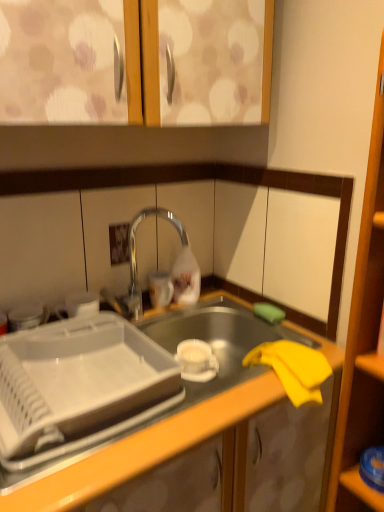
This screenshot has height=512, width=384. Describe the element at coordinates (362, 489) in the screenshot. I see `transparent plastic shelf at lower right` at that location.

This screenshot has height=512, width=384. Find the location of `white plastic tray at center`. white plastic tray at center is located at coordinates (78, 386).

Can you tell me how much polished chrome tap at center and transparent plastic shelf at lower right differ in facing direction?

They differ by 92.6 degrees in their facing directions.

From a real-world perspective, is polished chrome tap at center physically below transparent plastic shelf at lower right?

No, from a real-world perspective, polished chrome tap at center is not under transparent plastic shelf at lower right.

Between point (175, 216) and point (351, 470), which one is positioned behind?

The point (175, 216) is more distant.

Which of these two, polished chrome tap at center or transparent plastic shelf at lower right, stands taller?

Standing taller between the two is polished chrome tap at center.

Choose the correct answer: Is white plastic tray at center inside polished chrome tap at center or outside it?

white plastic tray at center lies outside polished chrome tap at center.

Is white plastic tray at center taller or shorter than polished chrome tap at center?

Considering their sizes, white plastic tray at center has less height than polished chrome tap at center.

Is point (102, 379) farther from viewer compared to point (180, 239)?

No, it is not.

Which object is positioned more to the left, white plastic tray at center or polished chrome tap at center?

From the viewer's perspective, white plastic tray at center appears more on the left side.

Which is nearer, (135, 230) or (0, 501)?

Point (135, 230) appears to be farther away from the viewer than point (0, 501).

Is polished chrome tap at center to the left or to the right of yellow fabric at lower right in the image?

polished chrome tap at center is positioned on yellow fabric at lower right's left side.

From a real-world perspective, is polished chrome tap at center positioned above or below yellow fabric at lower right?

polished chrome tap at center is above yellow fabric at lower right.

Locate an element on the screen. The width and height of the screenshot is (384, 512). shelf that appears behind the matte wood cabinet doors at upper center is located at coordinates (362, 489).

Between matte wood cabinet doors at upper center and transparent plastic shelf at lower right, which one appears on the right side from the viewer's perspective?

transparent plastic shelf at lower right is more to the right.

Considering the relative sizes of matte wood cabinet doors at upper center and transparent plastic shelf at lower right in the image provided, is matte wood cabinet doors at upper center bigger than transparent plastic shelf at lower right?

Indeed, matte wood cabinet doors at upper center has a larger size compared to transparent plastic shelf at lower right.

Does matte wood cabinet doors at upper center contain transparent plastic shelf at lower right?

No, matte wood cabinet doors at upper center does not contain transparent plastic shelf at lower right.

In the scene shown: Is there a large distance between polished chrome tap at center and white plastic tray at center?

polished chrome tap at center is near white plastic tray at center, not far away.

From a real-world perspective, relative to white plastic tray at center, is polished chrome tap at center vertically above or below?

polished chrome tap at center is situated higher than white plastic tray at center in the real world.

Looking at the image, does polished chrome tap at center seem bigger or smaller compared to white plastic tray at center?

Clearly, polished chrome tap at center is smaller in size than white plastic tray at center.

Where is `appliance below the polished chrome tap at center (from the image's perspective)`? This screenshot has width=384, height=512. appliance below the polished chrome tap at center (from the image's perspective) is located at coordinates (78, 386).

What are the coordinates of `countertop in front of the white plastic tray at center` in the screenshot? It's located at (145, 448).

Considering the relative sizes of white plastic tray at center and yellow fabric at lower right in the image provided, is white plastic tray at center bigger than yellow fabric at lower right?

No.

Is white plastic tray at center looking in the opposite direction of yellow fabric at lower right?

No, white plastic tray at center is not facing the opposite direction of yellow fabric at lower right.

Is point (18, 459) closer to camera compared to point (81, 474)?

No, (18, 459) is further to viewer.

Is matte wood cabinet doors at upper center in front of or behind white plastic tray at center in the image?

matte wood cabinet doors at upper center is in front of white plastic tray at center.

Is matte wood cabinet doors at upper center facing away from white plastic tray at center?

matte wood cabinet doors at upper center does not have its back to white plastic tray at center.

Where is `appliance that appears behind the matte wood cabinet doors at upper center`? The height and width of the screenshot is (512, 384). appliance that appears behind the matte wood cabinet doors at upper center is located at coordinates (78, 386).

How far apart are matte wood cabinet doors at upper center and white plastic tray at center?

matte wood cabinet doors at upper center and white plastic tray at center are 24.22 inches apart.

The height and width of the screenshot is (512, 384). I want to click on shelf in front of the polished chrome tap at center, so click(x=362, y=489).

I want to click on appliance below the polished chrome tap at center (from the image's perspective), so click(x=78, y=386).

Looking at this image, estimate the real-world distances between objects in this image. Which object is further from yellow fabric at lower right, polished chrome tap at center or white plastic tray at center?

polished chrome tap at center.

Looking at the image, which one is located closer to white plastic tray at center, transparent plastic shelf at lower right or yellow fabric at lower right?

yellow fabric at lower right is positioned closer to the anchor white plastic tray at center.

Estimate the real-world distances between objects in this image. Which object is closer to matte wood cabinet doors at upper center, transparent plastic shelf at lower right or white plastic tray at center?

Based on the image, white plastic tray at center appears to be nearer to matte wood cabinet doors at upper center.

Based on their spatial positions, is polished chrome tap at center or transparent plastic shelf at lower right closer to yellow fabric at lower right?

transparent plastic shelf at lower right is positioned closer to the anchor yellow fabric at lower right.

Looking at this image, which object lies further to the anchor point polished chrome tap at center, transparent plastic shelf at lower right or white plastic tray at center?

Based on the image, transparent plastic shelf at lower right appears to be further to polished chrome tap at center.

Based on their spatial positions, is yellow fabric at lower right or white plastic tray at center further from transparent plastic shelf at lower right?

white plastic tray at center lies further to transparent plastic shelf at lower right than the other object.

When comparing their distances from white plastic tray at center, does polished chrome tap at center or yellow fabric at lower right seem closer?

yellow fabric at lower right lies closer to white plastic tray at center than the other object.

From the image, which object appears to be nearer to white plastic tray at center, yellow fabric at lower right or polished chrome tap at center?

yellow fabric at lower right.

Identify the location of shelf between polished chrome tap at center and yellow fabric at lower right in the up-down direction. (362, 489).

Where is `countertop situated between white plastic tray at center and transparent plastic shelf at lower right from left to right`? The width and height of the screenshot is (384, 512). countertop situated between white plastic tray at center and transparent plastic shelf at lower right from left to right is located at coordinates (145, 448).

Locate an element on the screen. tap between white plastic tray at center and transparent plastic shelf at lower right from left to right is located at coordinates (135, 252).

This screenshot has width=384, height=512. I want to click on tap between matte wood cabinet doors at upper center and transparent plastic shelf at lower right vertically, so click(x=135, y=252).